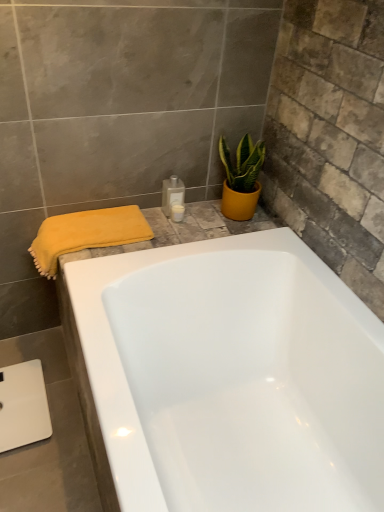
Locate an element on the screen. vacant space in front of yellow matte pot at upper right is located at coordinates tap(218, 231).